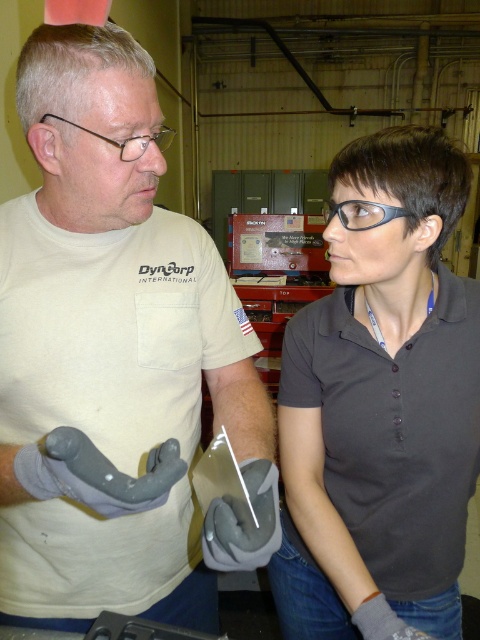
Does dark gray matte shirt at center come behind black plastic glasses at center?

That is False.

Is dark gray matte shirt at center to the left of black plastic glasses at center from the viewer's perspective?

In fact, dark gray matte shirt at center is to the right of black plastic glasses at center.

Does point (410, 193) lie behind point (342, 216)?

No, (410, 193) is in front of (342, 216).

You are a GUI agent. You are given a task and a screenshot of the screen. Output one action in this format:
    pyautogui.click(x=<x>, y=<y>)
    Task: Click on the dark gray matte shirt at center
    The image size is (480, 640).
    Given the screenshot: What is the action you would take?
    pyautogui.click(x=382, y=404)

Who is more forward, (x=21, y=296) or (x=394, y=564)?

Point (x=21, y=296) is more forward.

Which of these two, gray rubber gloves at center or dark gray matte shirt at center, stands shorter?

dark gray matte shirt at center is shorter.

Identify the location of gray rubber gloves at center. The image size is (480, 640). (115, 362).

Is gray rubber gloves at center to the left of black plastic glasses at center from the viewer's perspective?

Correct, you'll find gray rubber gloves at center to the left of black plastic glasses at center.

Which is more to the right, gray rubber gloves at center or black plastic glasses at center?

black plastic glasses at center is more to the right.

The width and height of the screenshot is (480, 640). In order to click on gray rubber gloves at center in this screenshot , I will do `click(115, 362)`.

I want to click on gray rubber gloves at center, so click(x=115, y=362).